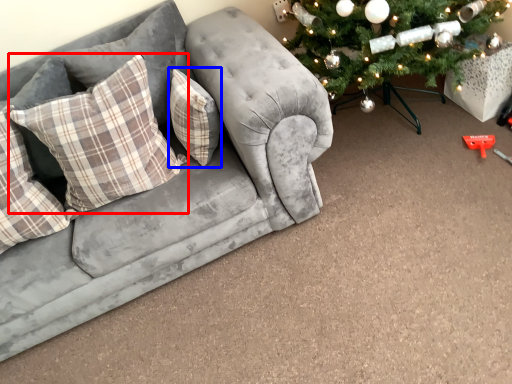
Question: Which object appears farthest to the camera in this image, pillow (highlighted by a red box) or pillow (highlighted by a blue box)?

Choices:
 (A) pillow
 (B) pillow

Answer: (B)